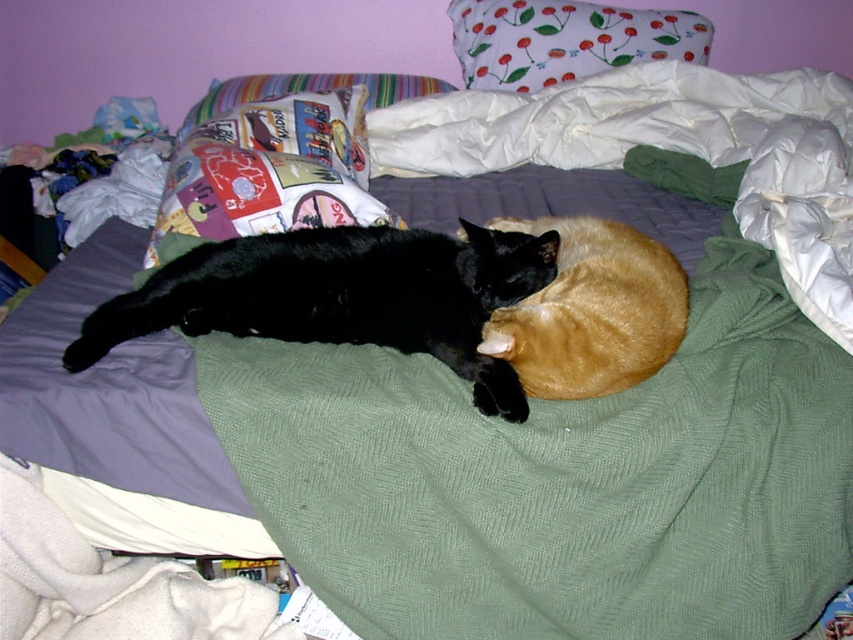
Is point (445, 342) more distant than point (695, 26)?

No, it is not.

Is point (404, 305) closer to viewer compared to point (535, 72)?

Yes, point (404, 305) is in front of point (535, 72).

You are a GUI agent. You are given a task and a screenshot of the screen. Output one action in this format:
    pyautogui.click(x=<x>, y=<y>)
    Task: Click on the black fur cat at center
    This screenshot has width=853, height=640.
    Given the screenshot: What is the action you would take?
    pyautogui.click(x=341, y=296)

Consider the image. Who is more forward, (315, 122) or (637, 326)?

Point (637, 326) is more forward.

Which of these two, multicolored fabric pillow at upper left or golden fur cat at center, stands shorter?

golden fur cat at center

In order to click on multicolored fabric pillow at upper left in this screenshot , I will do `click(271, 170)`.

Who is more forward, [224,138] or [576,68]?

Point [224,138]

Which is more to the right, multicolored fabric pillow at upper left or floral fabric pillow at upper center?

floral fabric pillow at upper center is more to the right.

Between point (303, 216) and point (463, 35), which one is positioned in front?

Positioned in front is point (303, 216).

At what (x,y) coordinates should I click in order to perform the action: click on multicolored fabric pillow at upper left. Please return your answer as a coordinate pair (x, y). Looking at the image, I should click on (271, 170).